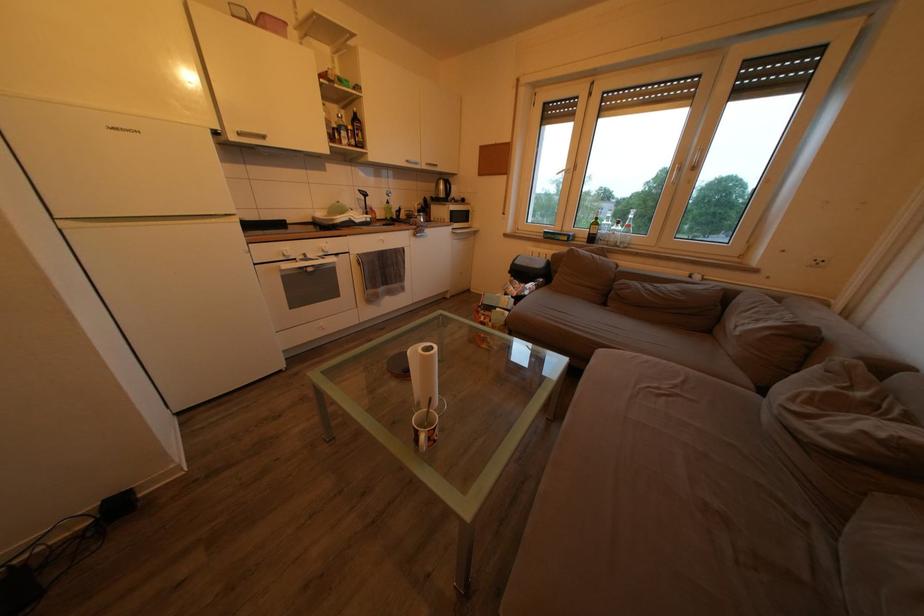
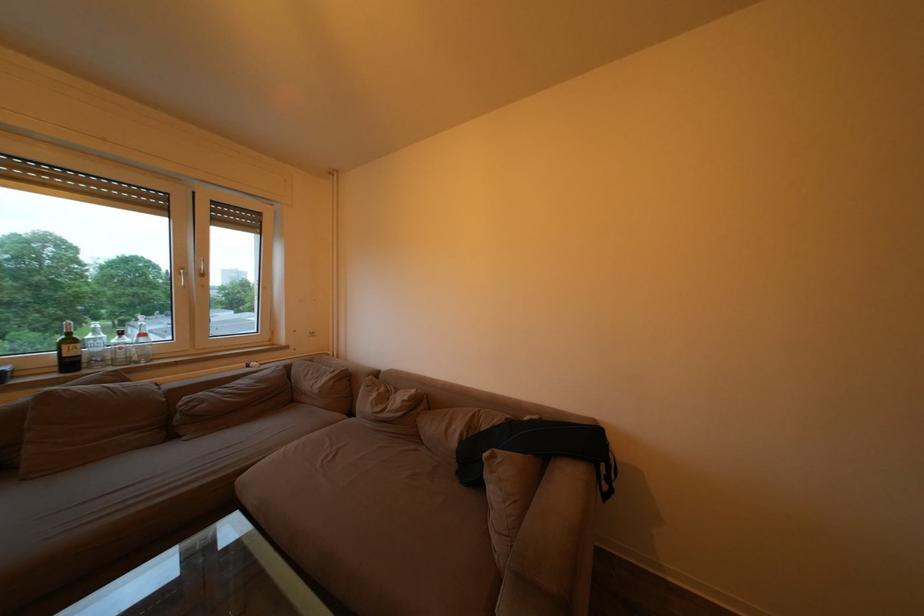
Locate, in the second image, the point that corresponds to pixel 626 229 in the first image.

(129, 339)